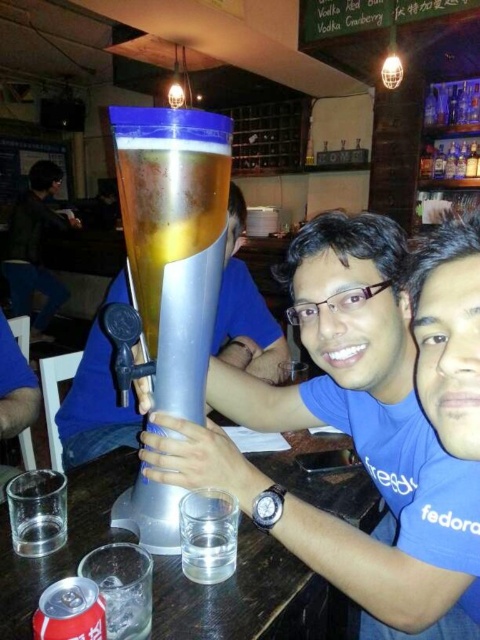
Can you confirm if silver metallic beer at center is smaller than matte silver beer tap at center?

Yes, silver metallic beer at center is smaller than matte silver beer tap at center.

Who is taller, silver metallic beer at center or matte silver beer tap at center?

matte silver beer tap at center

Find the location of a particular element. The image size is (480, 640). silver metallic beer at center is located at coordinates (173, 243).

Can you confirm if metallic silver cup at center is positioned to the right of matte silver beer tap at center?

Yes, metallic silver cup at center is to the right of matte silver beer tap at center.

Identify the location of metallic silver cup at center. The width and height of the screenshot is (480, 640). (349, 435).

Is point (392, 316) positioned behind point (79, 435)?

That is False.

Find the location of a particular element. metallic silver cup at center is located at coordinates (349, 435).

Is point (229, 467) farther from viewer compared to point (217, 195)?

Yes.

Can you confirm if metallic silver cup at center is smaller than silver metallic beer at center?

Actually, metallic silver cup at center might be larger than silver metallic beer at center.

What are the coordinates of `metallic silver cup at center` in the screenshot? It's located at (349, 435).